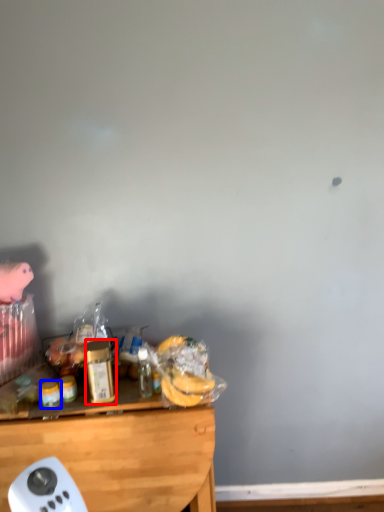
Question: Which point is further to the camera, bottle (highlighted by a red box) or food (highlighted by a blue box)?

Choices:
 (A) bottle
 (B) food

Answer: (B)